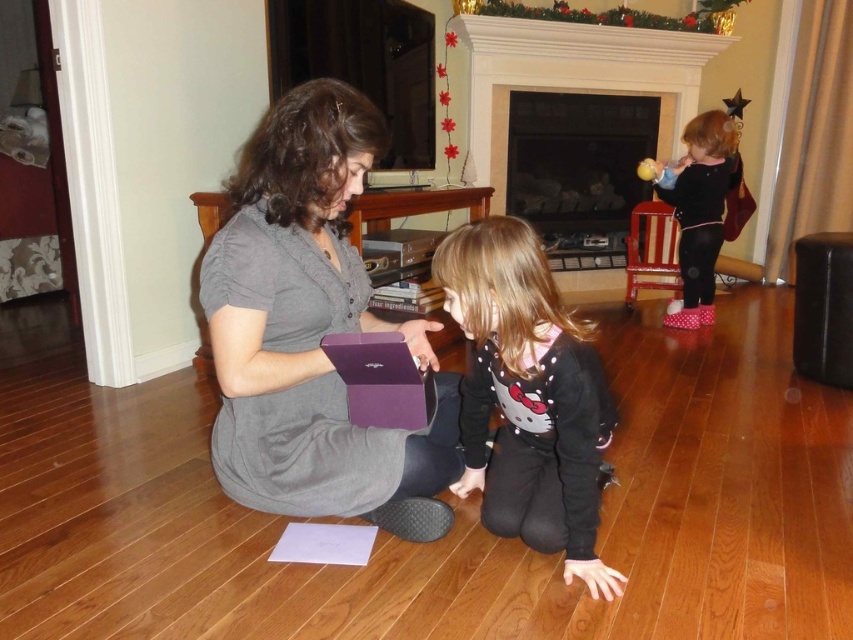
Does point (506, 268) come farther from viewer compared to point (624, 168)?

No, (506, 268) is in front of (624, 168).

Measure the distance between black matte sweater at center and dark wood fireplace at center.

black matte sweater at center and dark wood fireplace at center are 3.12 meters apart.

The width and height of the screenshot is (853, 640). What do you see at coordinates (527, 396) in the screenshot? I see `black matte sweater at center` at bounding box center [527, 396].

I want to click on black matte sweater at center, so click(527, 396).

Measure the distance between white marble fireplace at upper center and camera.

A distance of 4.28 meters exists between white marble fireplace at upper center and camera.

Describe the element at coordinates (573, 76) in the screenshot. I see `white marble fireplace at upper center` at that location.

Who is more distant from viewer, (590,276) or (737,163)?

The point (590,276) is behind.

Where is `white marble fireplace at upper center`? white marble fireplace at upper center is located at coordinates (573, 76).

Who is more forward, (521,134) or (683,131)?

Point (683,131)

Does dark wood fireplace at center appear over black velvet dress at upper right?

Correct, dark wood fireplace at center is located above black velvet dress at upper right.

Does point (590, 160) come behind point (703, 308)?

Yes.

Locate an element on the screen. This screenshot has height=640, width=853. dark wood fireplace at center is located at coordinates (573, 161).